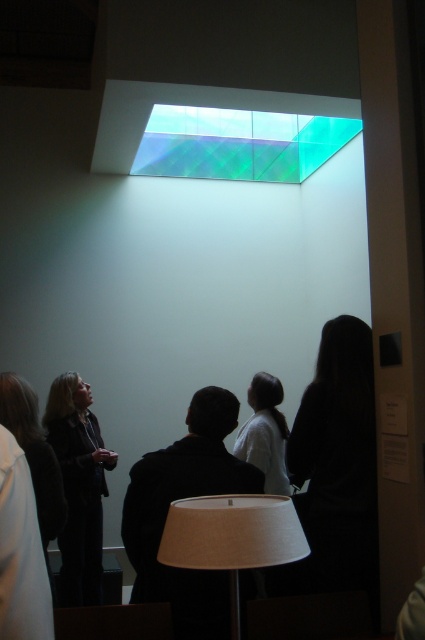
Is point (226, 548) farther from camera compared to point (101, 496)?

No.

Does white fabric lampshade at lower center have a smaller size compared to dark brown leather jacket at lower left?

Yes, white fabric lampshade at lower center is smaller than dark brown leather jacket at lower left.

Describe the element at coordinates (232, 538) in the screenshot. The height and width of the screenshot is (640, 425). I see `white fabric lampshade at lower center` at that location.

At what (x,y) coordinates should I click in order to perform the action: click on white fabric lampshade at lower center. Please return your answer as a coordinate pair (x, y). Looking at the image, I should click on (232, 538).

Between white fabric lampshade at lower center and dark brown hair at left, which one appears on the right side from the viewer's perspective?

white fabric lampshade at lower center is more to the right.

Is white fabric lampshade at lower center above dark brown hair at left?

No.

Find the location of `white fabric lampshade at lower center`. white fabric lampshade at lower center is located at coordinates (232, 538).

Find the location of a particular element. white fabric lampshade at lower center is located at coordinates (232, 538).

Who is taller, dark brown leather jacket at lower left or dark brown hair at left?

With more height is dark brown leather jacket at lower left.

This screenshot has height=640, width=425. What are the coordinates of `dark brown leather jacket at lower left` in the screenshot? It's located at (79, 486).

Which is in front, point (76, 428) or point (31, 392)?

Point (31, 392) is more forward.

Locate an element on the screen. Image resolution: width=425 pixels, height=640 pixels. dark brown leather jacket at lower left is located at coordinates (79, 486).